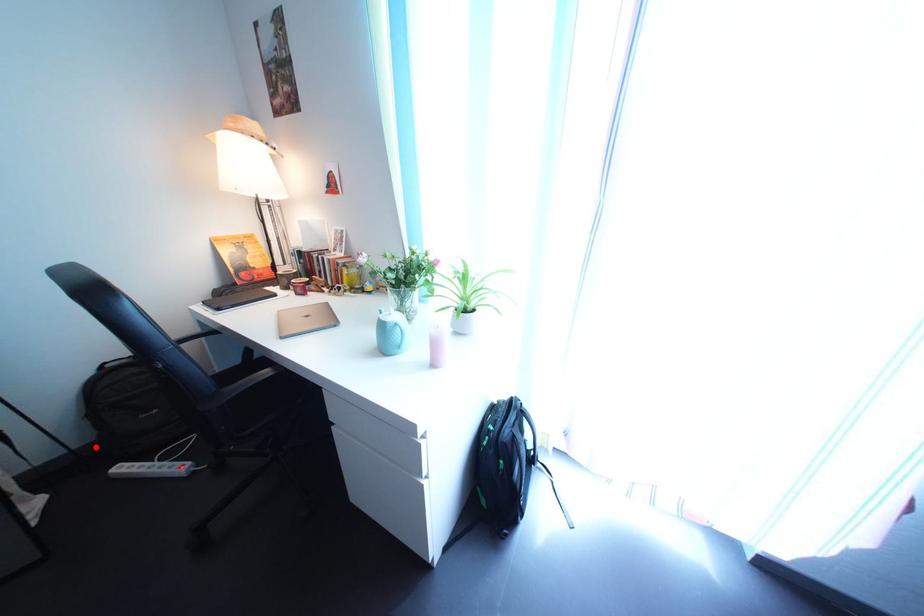
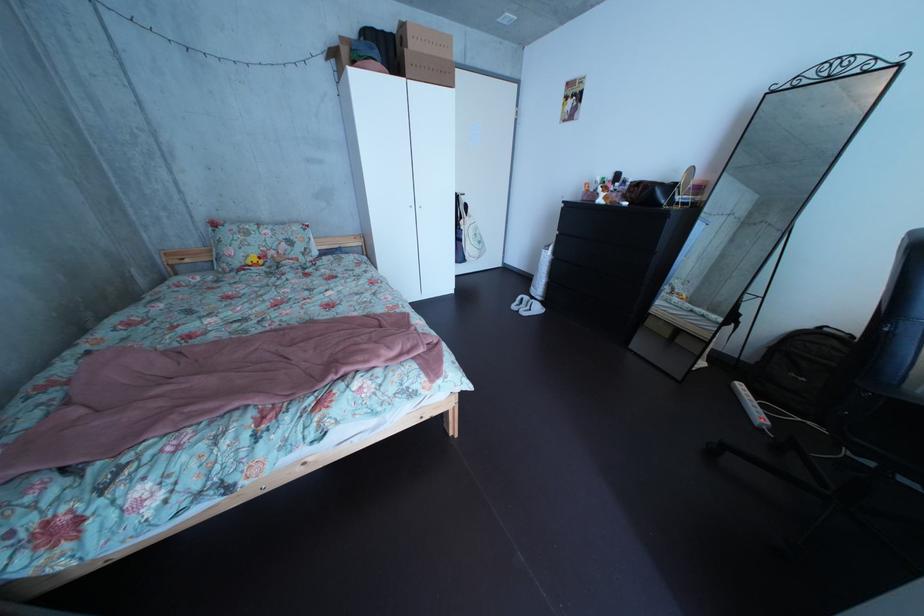
Question: I am providing you with two images of the same scene from different viewpoints. In image1, a red point is highlighted. Considering the same 3D point in image2, which of the following is correct?

Choices:
 (A) It is closer
 (B) It is farther

Answer: (A)